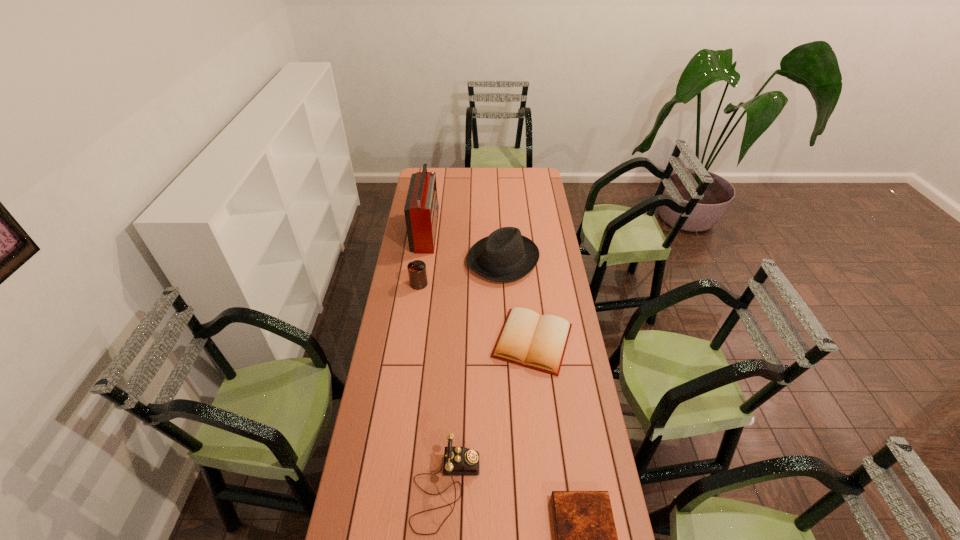
Find the location of `free space located on the left of the farther Bible`. free space located on the left of the farther Bible is located at coordinates (459, 341).

The width and height of the screenshot is (960, 540). What are the coordinates of `radio receiver present at the left edge` in the screenshot? It's located at (421, 208).

You are a GUI agent. You are given a task and a screenshot of the screen. Output one action in this format:
    pyautogui.click(x=<x>, y=<y>)
    Task: Click on the can positioned at the left edge
    
    Given the screenshot: What is the action you would take?
    pyautogui.click(x=417, y=273)

At what (x,y) coordinates should I click in order to perform the action: click on fedora present at the right edge. Please return your answer as a coordinate pair (x, y). Looking at the image, I should click on (505, 255).

Where is `Bible present at the right edge`? Image resolution: width=960 pixels, height=540 pixels. Bible present at the right edge is located at coordinates (538, 342).

The width and height of the screenshot is (960, 540). In the image, there is a desktop. Find the location of `vacant region at the far edge`. vacant region at the far edge is located at coordinates (462, 180).

Where is `vacant space at the left edge`? vacant space at the left edge is located at coordinates (418, 368).

In the image, there is a desktop. Where is `vacant area at the right edge`? This screenshot has height=540, width=960. vacant area at the right edge is located at coordinates (561, 255).

The image size is (960, 540). In order to click on vacant region at the far left corner of the desktop in this screenshot , I will do `click(441, 171)`.

At what (x,y) coordinates should I click in order to perform the action: click on free space at the far right corner. Please return your answer as a coordinate pair (x, y). The height and width of the screenshot is (540, 960). Looking at the image, I should click on (537, 182).